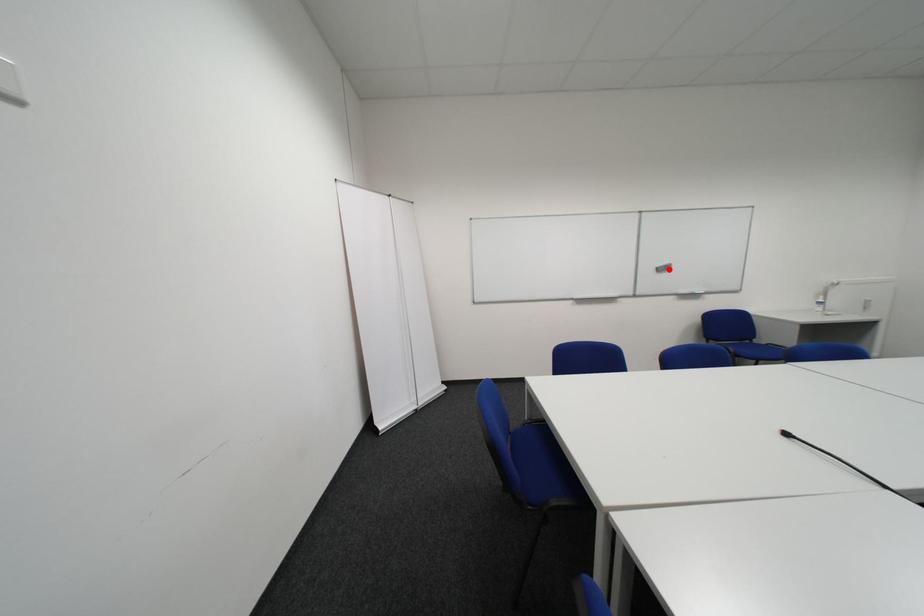
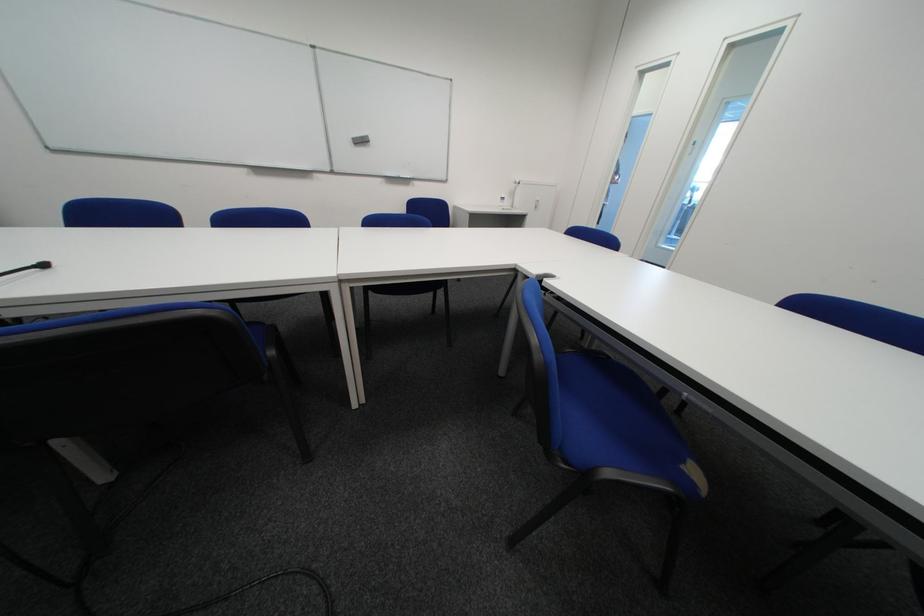
Question: I am providing you with two images of the same scene from different viewpoints. A red point is marked on the first image. At the location where the point appears in image 1, is it still visible in image 2?

Choices:
 (A) Yes
 (B) No

Answer: (A)